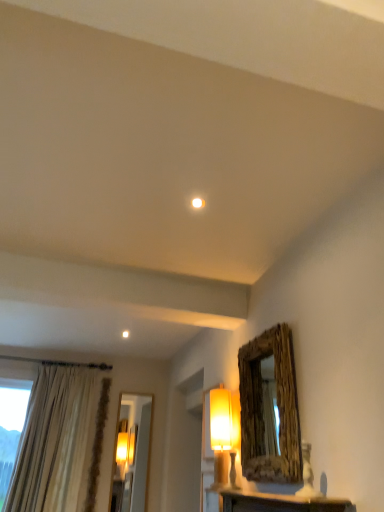
Question: Is matte yellow fabric lampshade at center-right oriented towards wooden frame mirror at upper right?

Choices:
 (A) yes
 (B) no

Answer: (B)

Question: From the image's perspective, is matte yellow fabric lampshade at center-right beneath wooden frame mirror at upper right?

Choices:
 (A) yes
 (B) no

Answer: (A)

Question: Does matte yellow fabric lampshade at center-right come behind wooden frame mirror at upper right?

Choices:
 (A) no
 (B) yes

Answer: (B)

Question: From the image's perspective, is matte yellow fabric lampshade at center-right on top of wooden frame mirror at upper right?

Choices:
 (A) no
 (B) yes

Answer: (A)

Question: Is matte yellow fabric lampshade at center-right positioned far away from wooden frame mirror at upper right?

Choices:
 (A) yes
 (B) no

Answer: (B)

Question: From a real-world perspective, is matte yellow fabric lampshade at center-right below wooden frame mirror at upper right?

Choices:
 (A) no
 (B) yes

Answer: (B)

Question: Is white marble table at lower center positioned beyond the bounds of wooden frame mirror at upper right?

Choices:
 (A) no
 (B) yes

Answer: (B)

Question: From a real-world perspective, does white marble table at lower center sit lower than wooden frame mirror at upper right?

Choices:
 (A) no
 (B) yes

Answer: (B)

Question: Is white marble table at lower center facing towards wooden frame mirror at upper right?

Choices:
 (A) no
 (B) yes

Answer: (A)

Question: Is the position of white marble table at lower center more distant than that of wooden frame mirror at upper right?

Choices:
 (A) no
 (B) yes

Answer: (A)

Question: Is wooden frame mirror at upper right at the back of white marble table at lower center?

Choices:
 (A) no
 (B) yes

Answer: (A)

Question: Is the surface of white marble table at lower center in direct contact with wooden frame mirror at upper right?

Choices:
 (A) yes
 (B) no

Answer: (B)

Question: Is wooden frame mirror at upper right oriented away from matte yellow fabric lampshade at center-right?

Choices:
 (A) yes
 (B) no

Answer: (B)